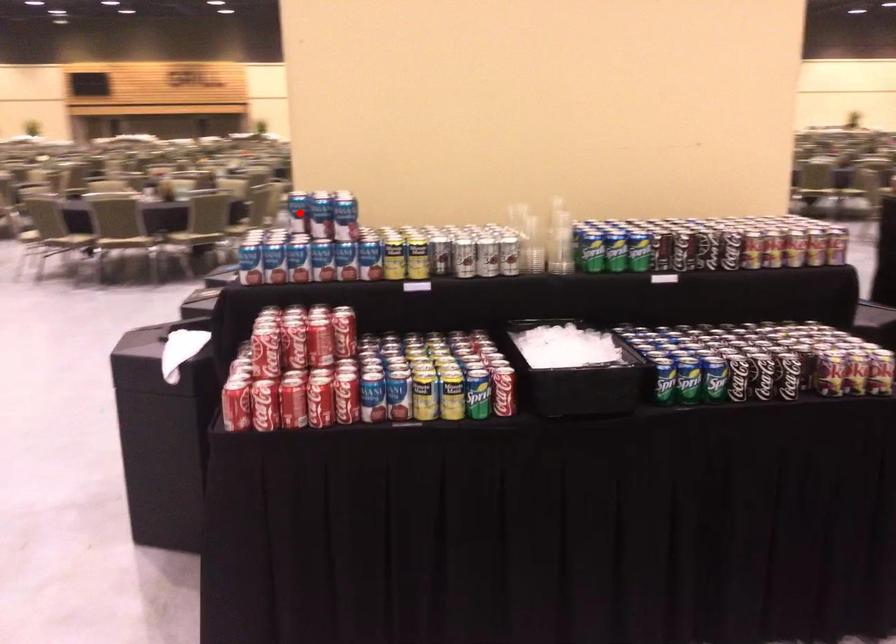
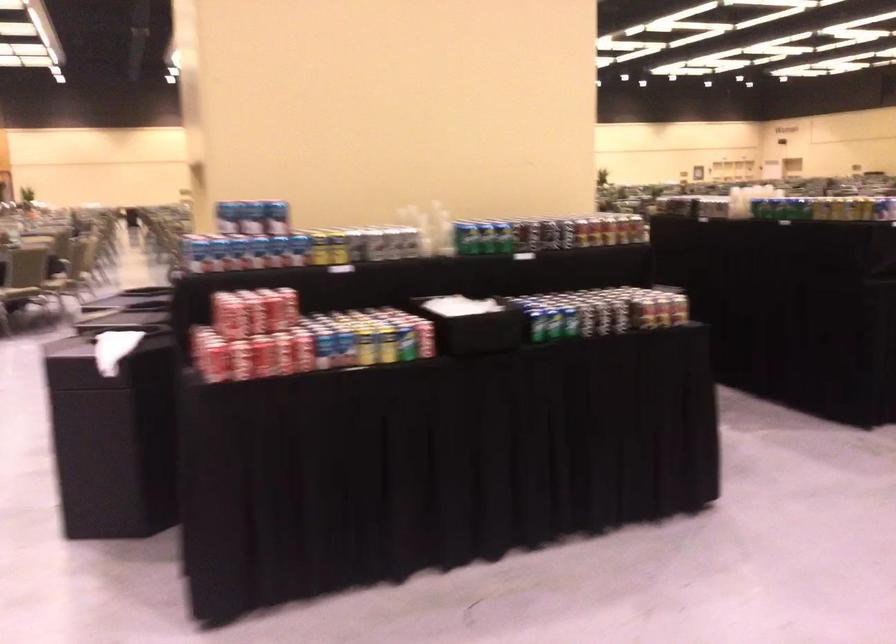
Question: I am providing you with two images of the same scene from different viewpoints. A red point is marked on the first image. Can you still see the location of the red point in image 2?

Choices:
 (A) Yes
 (B) No

Answer: (A)